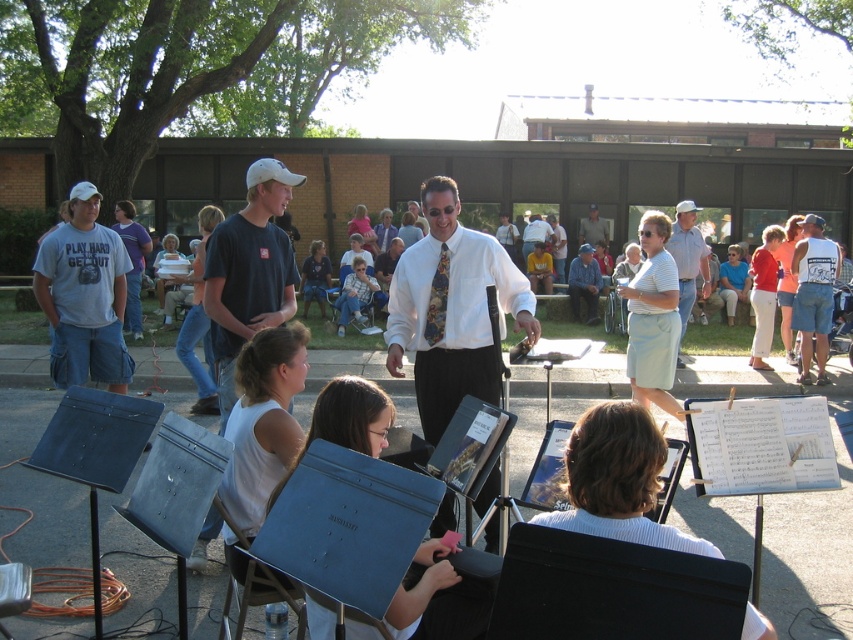
Question: Which object appears farthest from the camera in this image?

Choices:
 (A) gray cotton t-shirt at left
 (B) light blue shirt at center
 (C) white silk shirt at center
 (D) white shirt at center

Answer: (B)

Question: Estimate the real-world distances between objects in this image. Which object is closer to the white shirt at center?

Choices:
 (A) white silk shirt at center
 (B) gray cotton t-shirt at left
 (C) light blue shirt at center

Answer: (A)

Question: Can you confirm if white silk shirt at center is smaller than white shirt at center?

Choices:
 (A) yes
 (B) no

Answer: (A)

Question: Can you confirm if white silk shirt at center is positioned below gray cotton t-shirt at left?

Choices:
 (A) no
 (B) yes

Answer: (B)

Question: Is white silk shirt at center bigger than gray cotton t-shirt at left?

Choices:
 (A) yes
 (B) no

Answer: (B)

Question: Which point is farther from the camera taking this photo?

Choices:
 (A) (706, 266)
 (B) (70, 310)
 (C) (584, 236)

Answer: (C)